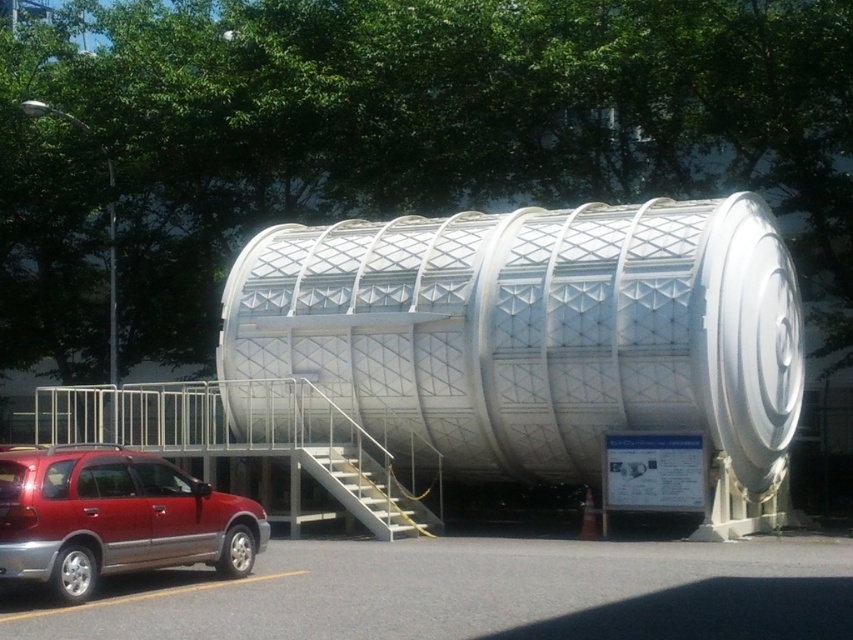
Question: Can you confirm if white metallic tank at center is positioned above shiny red suv at lower left?

Choices:
 (A) no
 (B) yes

Answer: (B)

Question: Among these points, which one is nearest to the camera?

Choices:
 (A) (538, 236)
 (B) (212, 502)

Answer: (B)

Question: Does white metallic tank at center appear on the left side of shiny red suv at lower left?

Choices:
 (A) no
 (B) yes

Answer: (A)

Question: Is white metallic tank at center further to camera compared to shiny red suv at lower left?

Choices:
 (A) yes
 (B) no

Answer: (A)

Question: Among these points, which one is nearest to the camera?

Choices:
 (A) (190, 534)
 (B) (648, 296)

Answer: (A)

Question: Which of the following is the closest to the observer?

Choices:
 (A) white metallic tank at center
 (B) shiny red suv at lower left

Answer: (B)